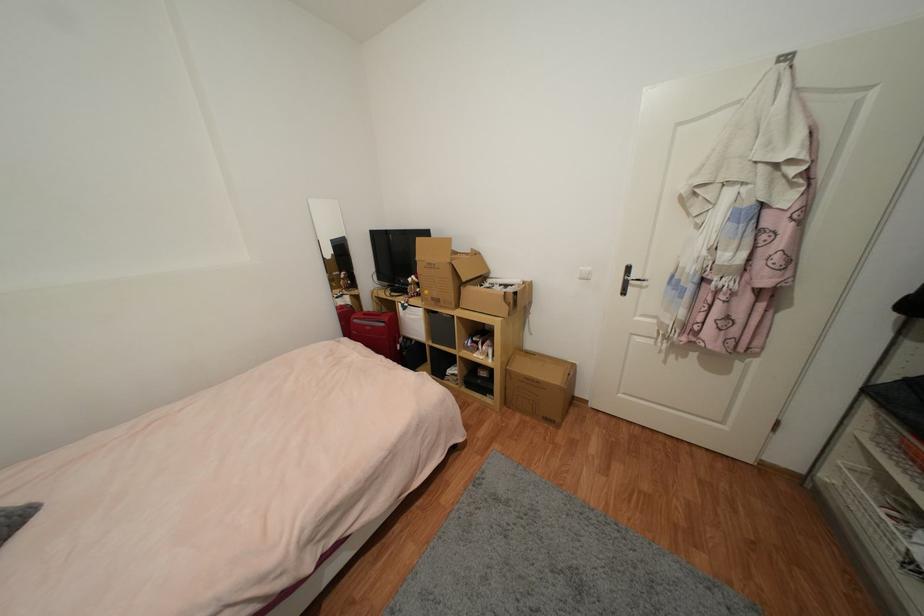
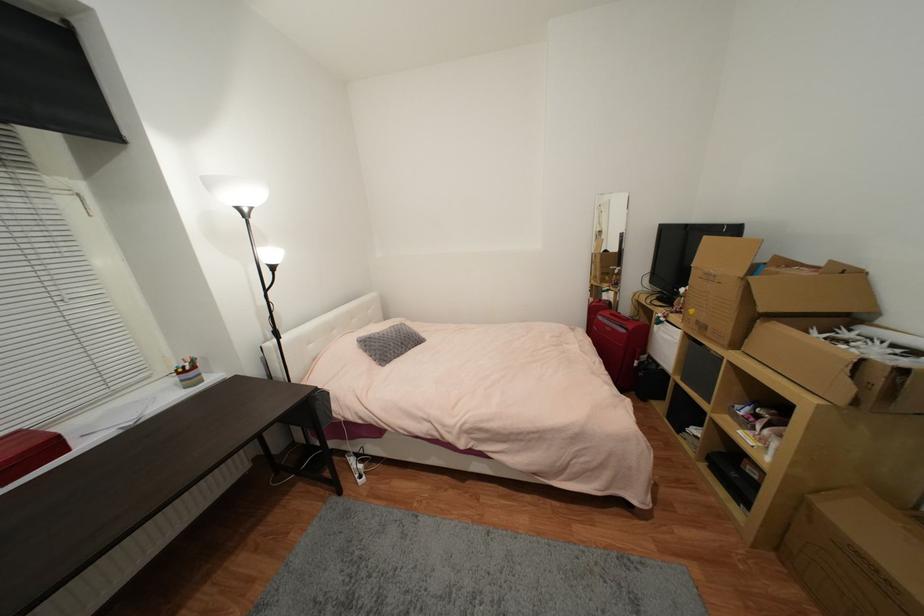
Find the pixel in the second image that matches point 468,281 in the first image.

(767, 310)